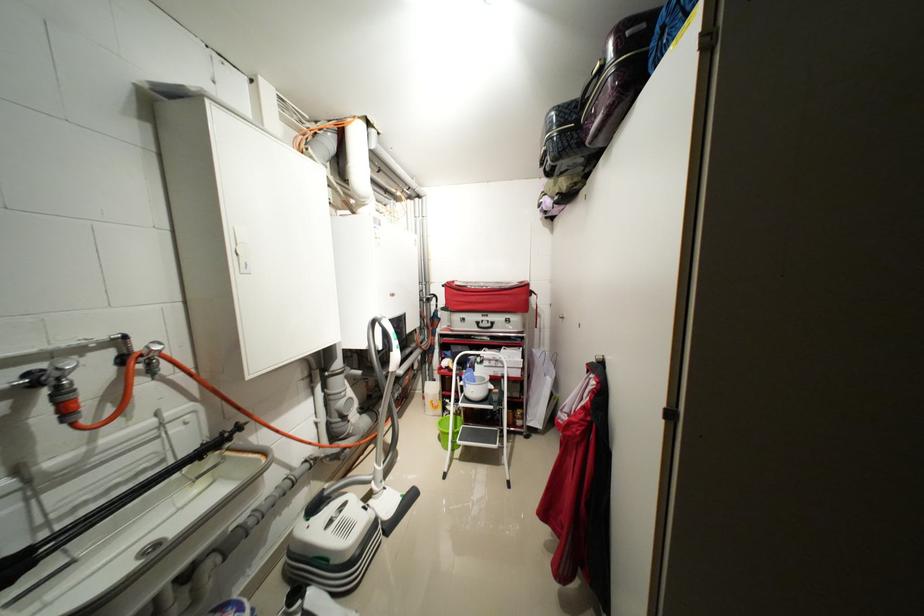
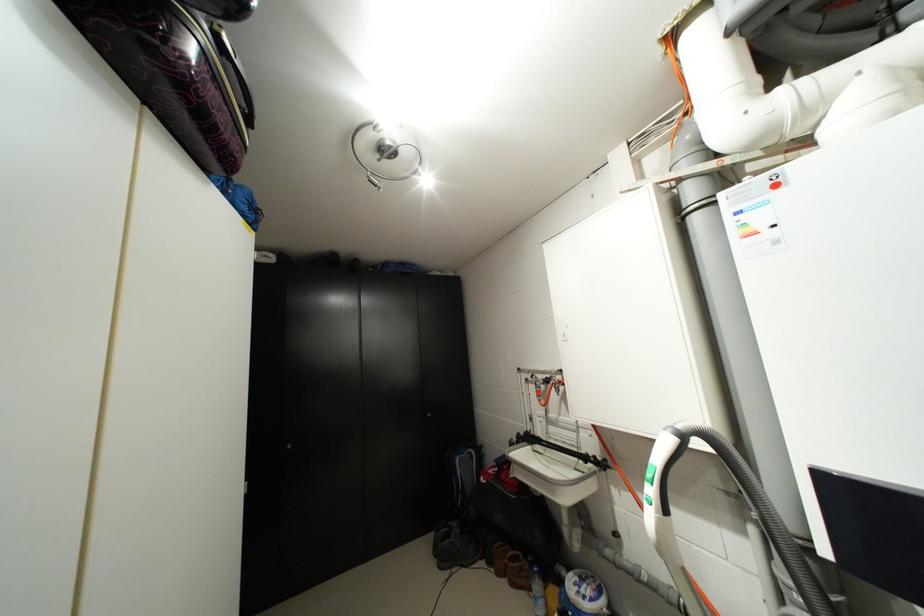
The point at (589, 145) is marked in the first image. Where is the corresponding point in the second image?

(189, 42)